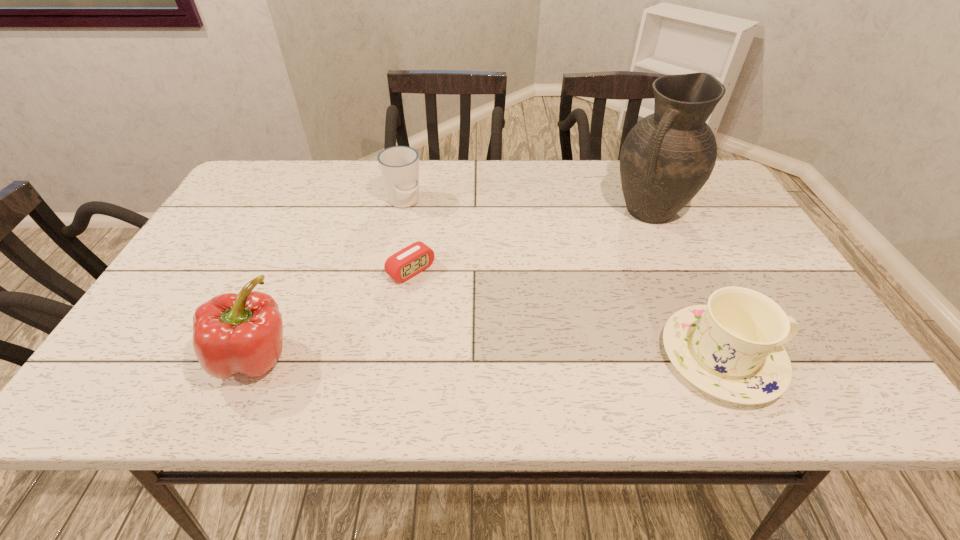
Identify the location of free spot on the desktop that is between the pepper and the chinaware and is positioned on the front-facing side of the third nearest object. This screenshot has width=960, height=540. (516, 356).

This screenshot has width=960, height=540. I want to click on free space on the desktop that is between the leftmost object and the chinaware and is positioned with a handle on the side of the cup, so click(x=470, y=356).

Locate an element on the screen. This screenshot has width=960, height=540. vacant space on the desktop that is between the leftmost object and the chinaware and is positioned on the side of the tallest object with the handle is located at coordinates (523, 356).